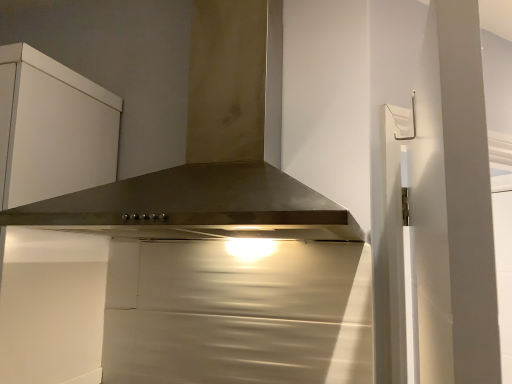
Describe the element at coordinates (120, 64) in the screenshot. This screenshot has width=512, height=384. I see `stainless steel range hood at center` at that location.

I want to click on stainless steel range hood at center, so click(x=120, y=64).

Image resolution: width=512 pixels, height=384 pixels. Find the location of `stainless steel range hood at center`. stainless steel range hood at center is located at coordinates (120, 64).